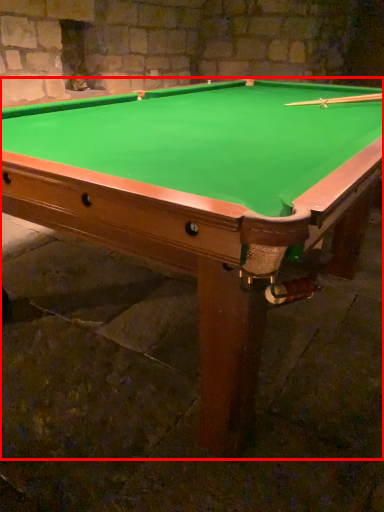
Question: From the image's perspective, considering the relative positions of billiard table (annotated by the red box) and cue in the image provided, where is billiard table (annotated by the red box) located with respect to the staircase?

Choices:
 (A) above
 (B) below

Answer: (B)